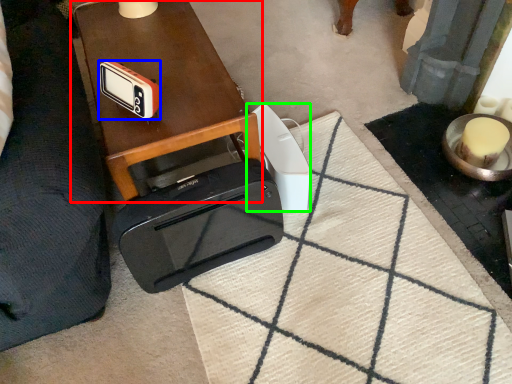
Question: Estimate the real-world distances between objects in this image. Which object is closer to table (highlighted by a red box), gadget (highlighted by a blue box) or gadget (highlighted by a green box)?

Choices:
 (A) gadget
 (B) gadget

Answer: (A)